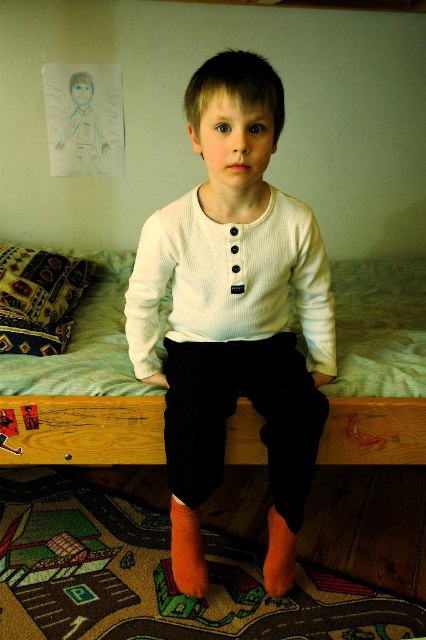
You are standing in the bedroom and want to reach a point that is 4.05 feet away from you. The point is located at coordinates point (x=288, y=554). Can you tell me which object in the bedroom is at that specific point?

Result: The point (x=288, y=554) is exactly at 4.05 feet away from you, so the object at that point is the boy sitting on the wooden bed frame.

You are a fashion designer trying to decide which garment to showcase in a catalog. You have two options from the image description provided. Which garment, the white ribbed shirt at center or the white ribbed sweater at center, would you choose if you want to feature the larger one?

The white ribbed shirt at center is larger in size than the white ribbed sweater at center, so you should choose the white ribbed shirt at center for showcasing the larger garment.

You are standing in the bedroom and want to place a small decorative item on the bed frame. You have two spots to choose from, one at point (x=180, y=236) and another at point (x=120, y=352). Which point is closer to you where you can place the item?

Point (x=180, y=236) is closer to the viewer than point (x=120, y=352), so you should place the item there.